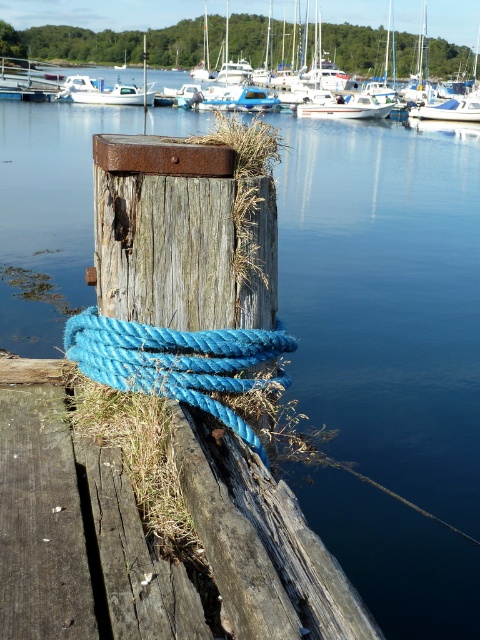
Based on the photo, you are standing on the dock and looking at two points marked in the scene. Which point, point (127, 93) or point (145, 83), is closer to you?

Point (127, 93) is closer to the viewer than point (145, 83).

You are standing on the weathered wood dock at lower left and want to board the white glossy boat at center. Is the boat above or below your current position?

The white glossy boat at center is above the weathered wood dock at lower left because the dock is below the boat.

You are standing on the weathered wood dock at lower left and want to board the white glossy boat at center. Which direction should you move to reach the boat?

You should move to the right because the weathered wood dock at lower left is to the left of the white glossy boat at center, so moving right will bring you towards the boat.